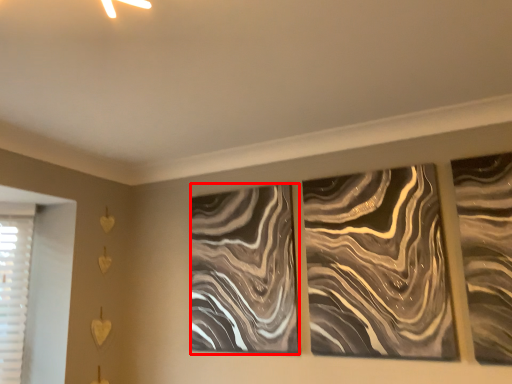
Question: From the image's perspective, what is the correct spatial positioning of design (annotated by the red box) in reference to design?

Choices:
 (A) above
 (B) below

Answer: (B)